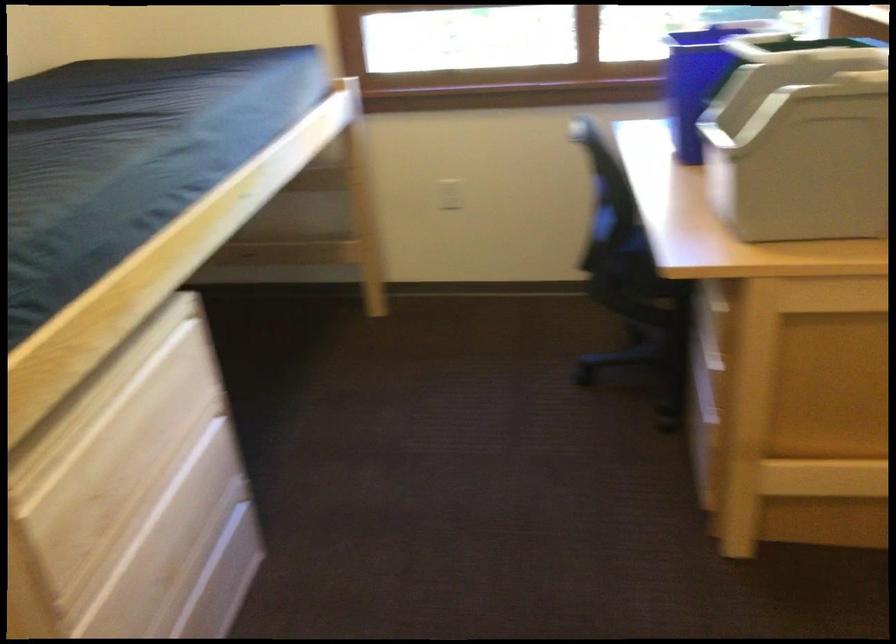
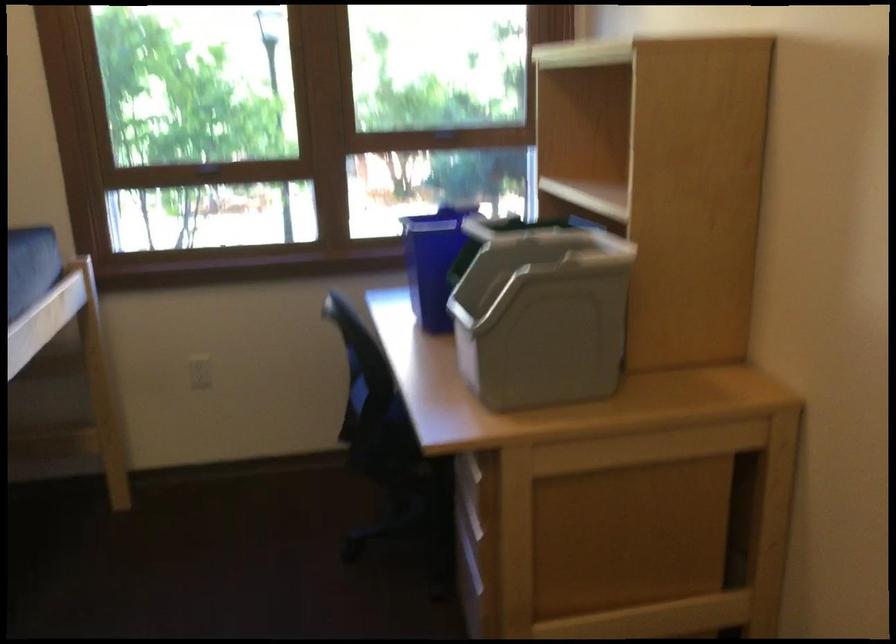
Where in the second image is the point corresponding to (444,194) from the first image?

(200, 372)